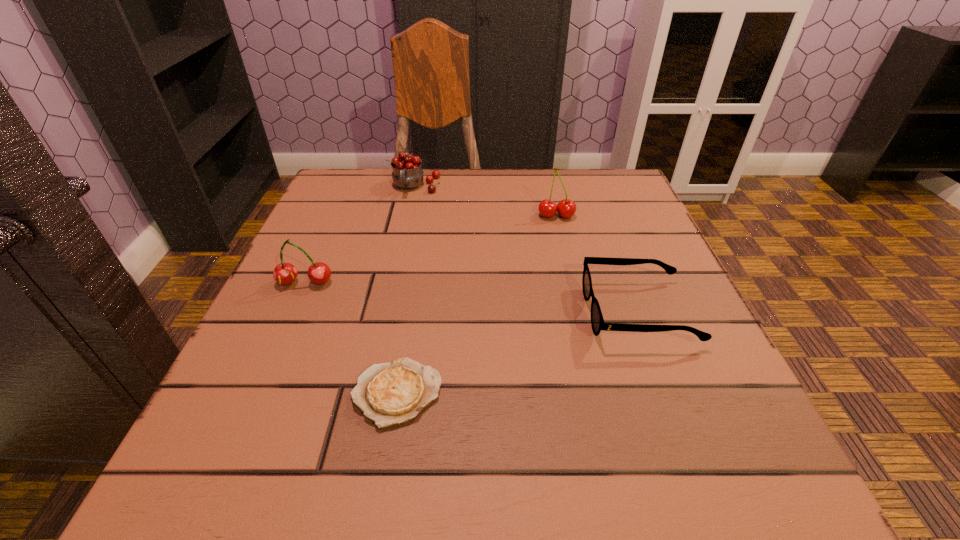
The width and height of the screenshot is (960, 540). Find the location of `free point that satisfies the following two spatial constraints: 1. with stems pointing upwards on the quiche; 2. on the right side of the leftmost object`. free point that satisfies the following two spatial constraints: 1. with stems pointing upwards on the quiche; 2. on the right side of the leftmost object is located at coordinates (256, 393).